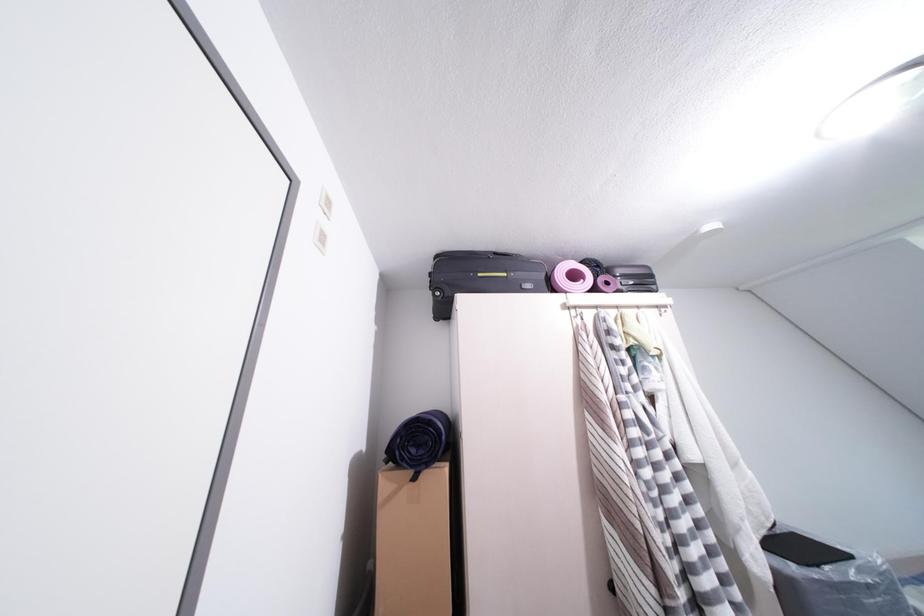
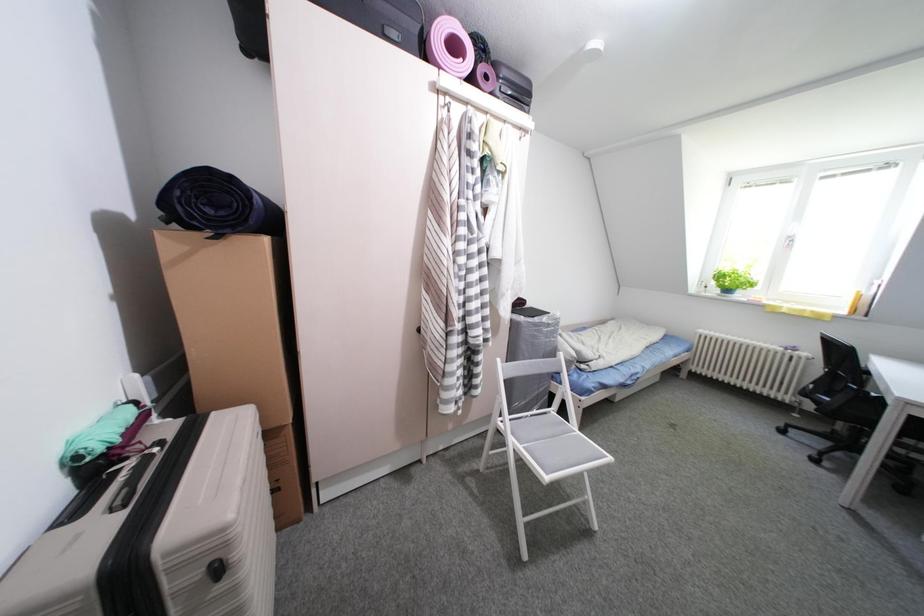
The first image is from the beginning of the video and the second image is from the end. How did the camera likely rotate when shooting the video?

The camera's rotation is toward right-down.